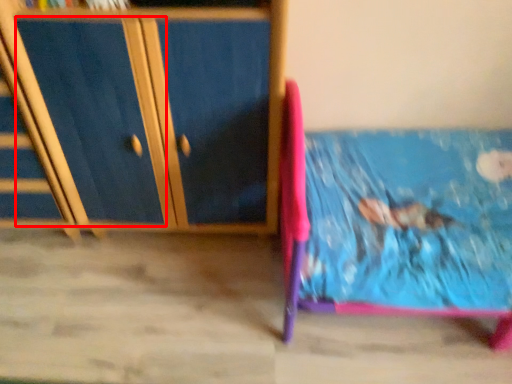
Question: From the image's perspective, where is drawer (annotated by the red box) located in relation to furniture in the image?

Choices:
 (A) below
 (B) above

Answer: (A)